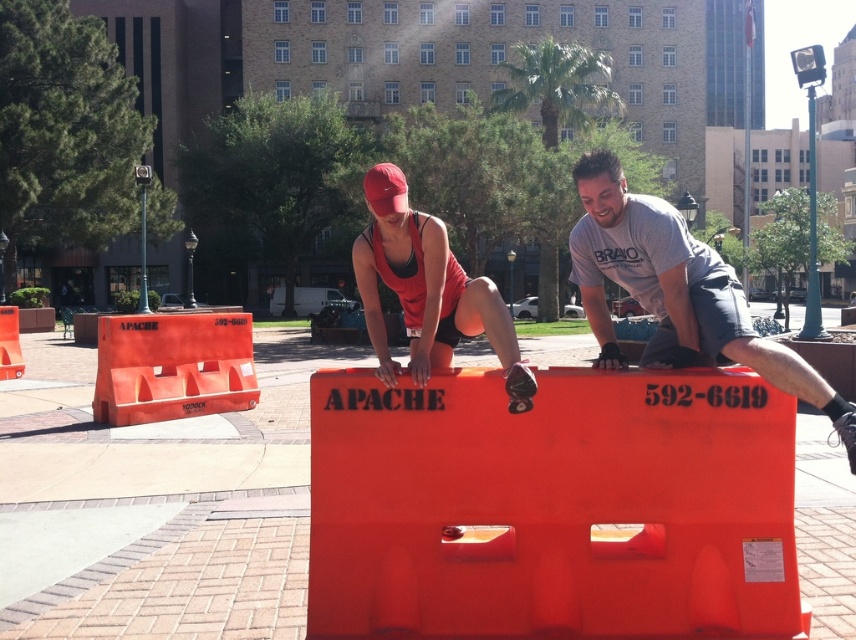
Describe the element at coordinates (676, 292) in the screenshot. I see `matte gray t-shirt at center` at that location.

From the picture: Is matte gray t-shirt at center thinner than matte orange helmet at center?

Incorrect, matte gray t-shirt at center's width is not less than matte orange helmet at center's.

Locate an element on the screen. The width and height of the screenshot is (856, 640). matte gray t-shirt at center is located at coordinates (676, 292).

Based on the photo, is orange plastic hurdle at center to the left of matte orange helmet at center from the viewer's perspective?

Incorrect, orange plastic hurdle at center is not on the left side of matte orange helmet at center.

Is orange plastic hurdle at center closer to camera compared to matte orange helmet at center?

Yes, orange plastic hurdle at center is in front of matte orange helmet at center.

At what (x,y) coordinates should I click in order to perform the action: click on orange plastic hurdle at center. Please return your answer as a coordinate pair (x, y). Looking at the image, I should click on (551, 506).

Locate an element on the screen. The image size is (856, 640). orange plastic hurdle at center is located at coordinates (551, 506).

Can you confirm if orange plastic hurdle at center is shorter than matte gray t-shirt at center?

Yes, orange plastic hurdle at center is shorter than matte gray t-shirt at center.

This screenshot has height=640, width=856. What do you see at coordinates (551, 506) in the screenshot?
I see `orange plastic hurdle at center` at bounding box center [551, 506].

Where is `orange plastic hurdle at center`? This screenshot has height=640, width=856. orange plastic hurdle at center is located at coordinates (551, 506).